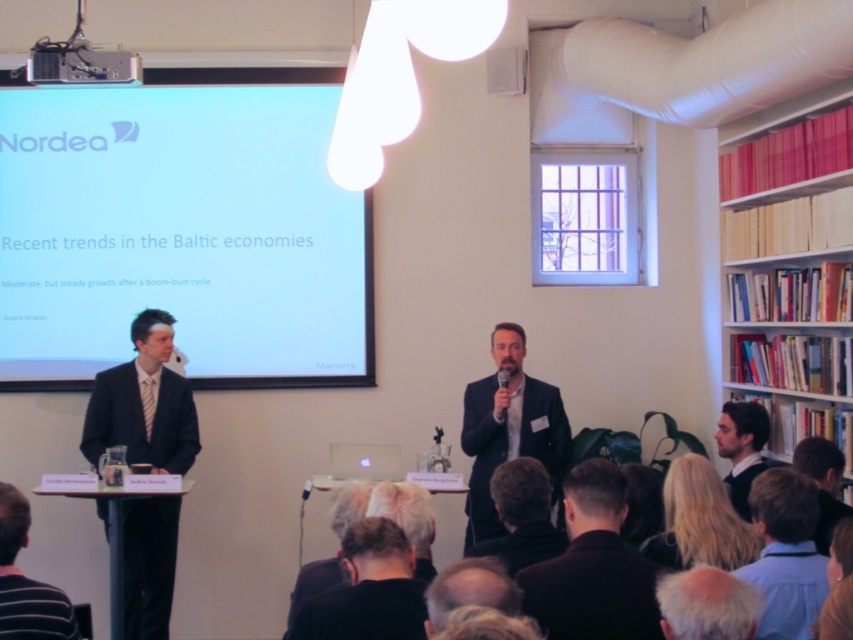
Question: Which point is closer to the camera?

Choices:
 (A) (722, 412)
 (B) (566, 440)

Answer: (A)

Question: Is dark blue suit at center to the left of dark brown suit at center from the viewer's perspective?

Choices:
 (A) yes
 (B) no

Answer: (B)

Question: Is the position of black fabric jacket at lower center more distant than that of blue shirt at lower right?

Choices:
 (A) no
 (B) yes

Answer: (A)

Question: Does striped cotton shirt at lower left appear on the right side of light brown hair at lower center?

Choices:
 (A) yes
 (B) no

Answer: (B)

Question: Which point is farther to the camera?

Choices:
 (A) blonde hair at lower right
 (B) light brown hair at lower center

Answer: (B)

Question: Which point appears closest to the camera in this image?

Choices:
 (A) (201, 115)
 (B) (38, 58)
 (C) (712, 541)

Answer: (C)